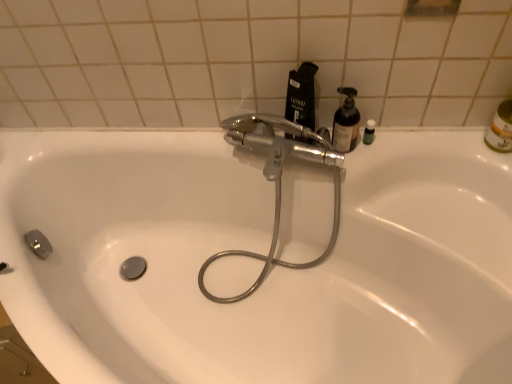
Question: From a real-world perspective, is white glossy sink at center on top of chrome metallic faucet at center?

Choices:
 (A) no
 (B) yes

Answer: (A)

Question: Does white glossy sink at center have a lesser height compared to chrome metallic faucet at center?

Choices:
 (A) no
 (B) yes

Answer: (A)

Question: Is white glossy sink at center looking in the opposite direction of chrome metallic faucet at center?

Choices:
 (A) no
 (B) yes

Answer: (B)

Question: From the image's perspective, would you say white glossy sink at center is shown under chrome metallic faucet at center?

Choices:
 (A) yes
 (B) no

Answer: (A)

Question: Is white glossy sink at center at the right side of chrome metallic faucet at center?

Choices:
 (A) yes
 (B) no

Answer: (A)

Question: From the image's perspective, relative to black matte bottle at upper center, is white glossy sink at center above or below?

Choices:
 (A) above
 (B) below

Answer: (B)

Question: Would you say white glossy sink at center is to the left or to the right of black matte bottle at upper center in the picture?

Choices:
 (A) right
 (B) left

Answer: (B)

Question: Considering their positions, is white glossy sink at center located in front of or behind black matte bottle at upper center?

Choices:
 (A) behind
 (B) front

Answer: (B)

Question: Considering the positions of white glossy sink at center and black matte bottle at upper center in the image, is white glossy sink at center wider or thinner than black matte bottle at upper center?

Choices:
 (A) thin
 (B) wide

Answer: (B)

Question: Looking at the image, does black matte bottle at upper center seem bigger or smaller compared to translucent plastic bottle at upper right?

Choices:
 (A) big
 (B) small

Answer: (A)

Question: Looking at their shapes, would you say black matte bottle at upper center is wider or thinner than translucent plastic bottle at upper right?

Choices:
 (A) thin
 (B) wide

Answer: (B)

Question: From a real-world perspective, is black matte bottle at upper center positioned above or below translucent plastic bottle at upper right?

Choices:
 (A) below
 (B) above

Answer: (B)

Question: Is black matte bottle at upper center inside or outside of translucent plastic bottle at upper right?

Choices:
 (A) inside
 (B) outside

Answer: (B)

Question: Which is correct: chrome metallic faucet at center is inside black matte bottle at upper center, or outside of it?

Choices:
 (A) outside
 (B) inside

Answer: (A)

Question: Is point (333, 178) positioned closer to the camera than point (310, 114)?

Choices:
 (A) farther
 (B) closer

Answer: (A)